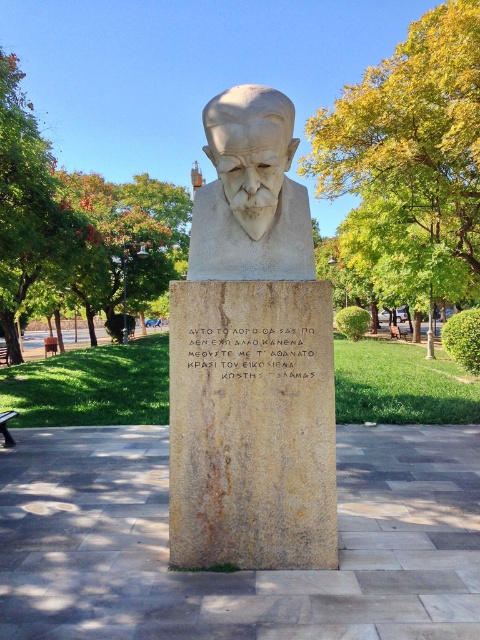
You are a visitor in the park and want to read the gray stone inscription at center. Where should you stand relative to the wooden park bench at lower left to see it clearly?

The gray stone inscription at center is located above the wooden park bench at lower left, so you should stand in front of the wooden park bench at lower left to see the inscription above it.

You are standing in the park looking at the statue. There are two points marked on the statue. The first point is at coordinate point (x=300, y=244) and the second point is at coordinate point (x=398, y=328). Which point appears closer to you?

Point (x=300, y=244) is closer to the camera than point (x=398, y=328), so the first point appears closer to you.